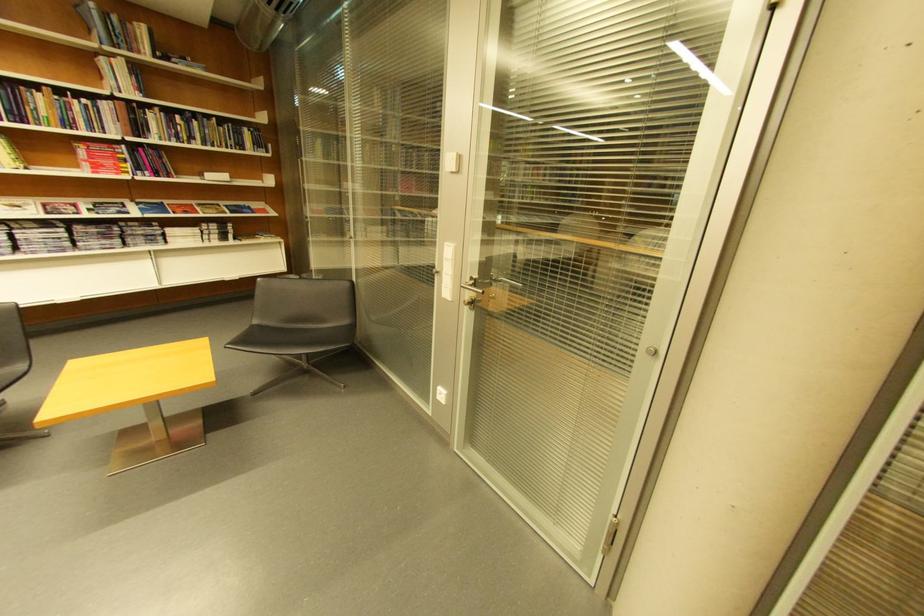
You are a GUI agent. You are given a task and a screenshot of the screen. Output one action in this format:
    pyautogui.click(x=<x>, y=<y>)
    Task: Click on the black chair sitting surface
    
    Given the screenshot: What is the action you would take?
    pyautogui.click(x=299, y=336)